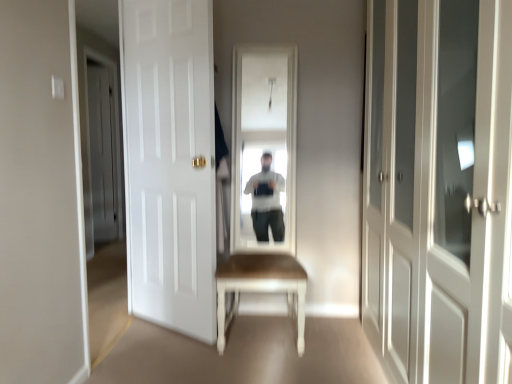
Question: Is white matte door at left, which appears as the first door when viewed from the left, completely or partially outside of white glossy cabinet at right, the 3th door from the back?

Choices:
 (A) no
 (B) yes

Answer: (B)

Question: Is white matte door at left, which appears as the first door when viewed from the left, not close to white glossy cabinet at right, the 3th door from the back?

Choices:
 (A) no
 (B) yes

Answer: (B)

Question: Considering the relative positions of white matte door at left, placed as the 3th door when sorted from front to back, and white glossy cabinet at right, placed as the first door when sorted from right to left, in the image provided, is white matte door at left, placed as the 3th door when sorted from front to back, behind white glossy cabinet at right, placed as the first door when sorted from right to left,?

Choices:
 (A) yes
 (B) no

Answer: (A)

Question: Is white matte door at left, which appears as the first door when viewed from the left, oriented away from white glossy cabinet at right, the 3th door from the back?

Choices:
 (A) no
 (B) yes

Answer: (A)

Question: Is white matte door at left, which appears as the first door when viewed from the left, thinner than white glossy cabinet at right, acting as the 1th door starting from the front?

Choices:
 (A) yes
 (B) no

Answer: (A)

Question: From a real-world perspective, is white matte door at left, which is counted as the first door, starting from the back, located higher than white glossy cabinet at right, placed as the first door when sorted from right to left?

Choices:
 (A) yes
 (B) no

Answer: (A)

Question: Considering the relative sizes of white matte door at center, which is counted as the 2th door, starting from the back, and white glossy cabinet at right, which is the 3th door from left to right, in the image provided, is white matte door at center, which is counted as the 2th door, starting from the back, shorter than white glossy cabinet at right, which is the 3th door from left to right,?

Choices:
 (A) yes
 (B) no

Answer: (B)

Question: From the image's perspective, is white matte door at center, which appears as the second door when viewed from the right, located beneath white glossy cabinet at right, acting as the 1th door starting from the front?

Choices:
 (A) yes
 (B) no

Answer: (B)

Question: Does white matte door at center, which is counted as the 2th door, starting from the back, appear on the right side of white glossy cabinet at right, which is the 3th door from left to right?

Choices:
 (A) yes
 (B) no

Answer: (B)

Question: Is white matte door at center, which appears as the second door when viewed from the right, at the left side of white glossy cabinet at right, the 3th door from the back?

Choices:
 (A) no
 (B) yes

Answer: (B)

Question: From the image's perspective, would you say white matte door at center, which appears as the second door when viewed from the right, is positioned over white glossy cabinet at right, which is the 3th door from left to right?

Choices:
 (A) yes
 (B) no

Answer: (A)

Question: Is white matte door at center, which is counted as the 2th door, starting from the left, placed right next to white glossy cabinet at right, which is the 3th door from left to right?

Choices:
 (A) yes
 (B) no

Answer: (B)

Question: Considering the relative sizes of white matte door at left, placed as the 3th door when sorted from front to back, and white matte door at center, which appears as the second door when viewed from the right, in the image provided, is white matte door at left, placed as the 3th door when sorted from front to back, bigger than white matte door at center, which appears as the second door when viewed from the right,?

Choices:
 (A) yes
 (B) no

Answer: (B)